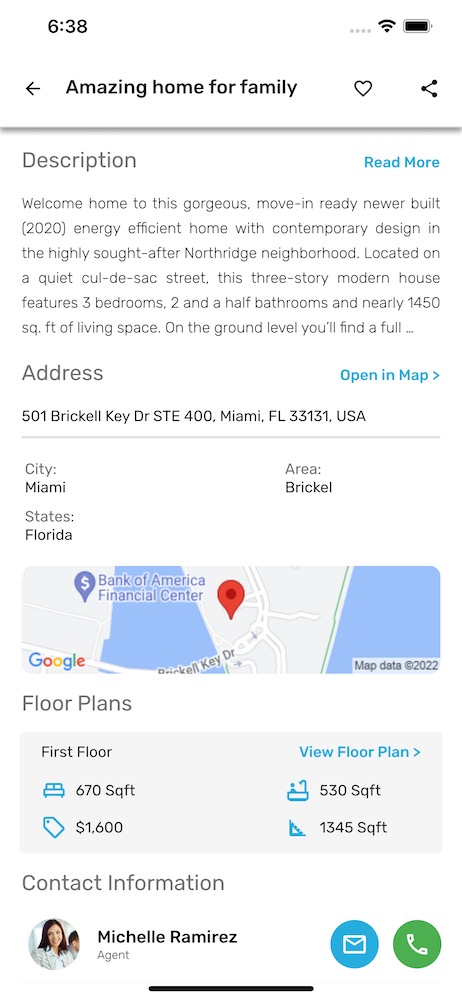
The image size is (462, 1000). What are the coordinates of `living room square footage` in the screenshot? It's located at (107, 783).